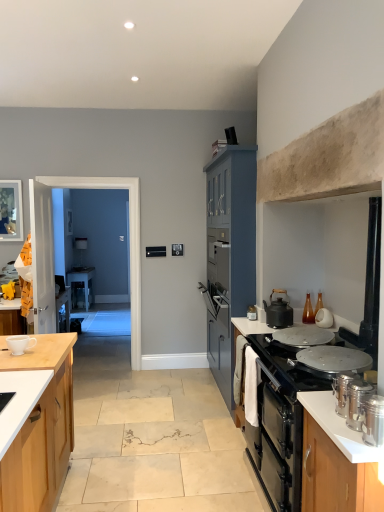
You are a GUI agent. You are given a task and a screenshot of the screen. Output one action in this format:
    pyautogui.click(x=<x>, y=<y>)
    Task: Click on the free area behind satin silver canisters at right, placed as the 3th kitchen appliance when sorted from back to front
    The width and height of the screenshot is (384, 512).
    Given the screenshot: What is the action you would take?
    pyautogui.click(x=326, y=401)